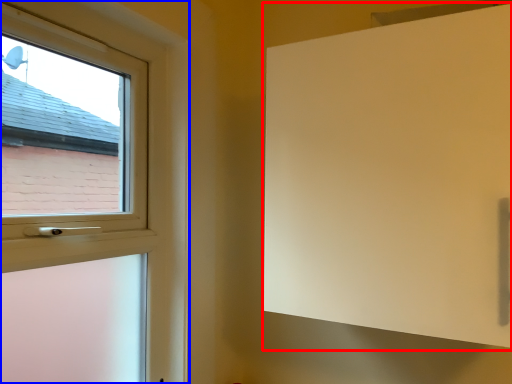
Question: Which point is further to the camera, screen door (highlighted by a red box) or window (highlighted by a blue box)?

Choices:
 (A) screen door
 (B) window

Answer: (A)